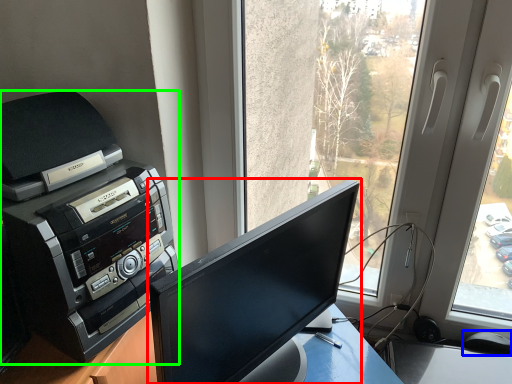
Question: Which object is the closest to the computer monitor (highlighted by a red box)? Choose among these: mouse (highlighted by a blue box) or printer (highlighted by a green box).

Choices:
 (A) mouse
 (B) printer

Answer: (B)